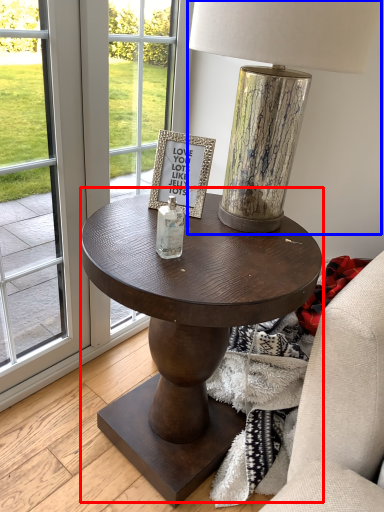
Question: Among these objects, which one is nearest to the camera, coffee table (highlighted by a red box) or table lamp (highlighted by a blue box)?

Choices:
 (A) coffee table
 (B) table lamp

Answer: (B)